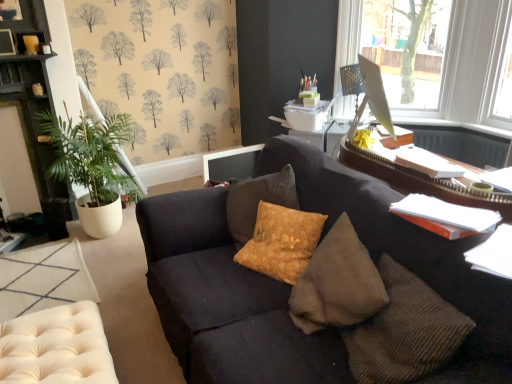
Question: Does transparent glass monitor at upper right turn towards dark wood cabinet at left?

Choices:
 (A) no
 (B) yes

Answer: (A)

Question: Considering the relative sizes of transparent glass monitor at upper right and dark wood cabinet at left in the image provided, is transparent glass monitor at upper right bigger than dark wood cabinet at left?

Choices:
 (A) no
 (B) yes

Answer: (B)

Question: From the image's perspective, would you say transparent glass monitor at upper right is positioned over dark wood cabinet at left?

Choices:
 (A) no
 (B) yes

Answer: (B)

Question: Can you confirm if transparent glass monitor at upper right is wider than dark wood cabinet at left?

Choices:
 (A) no
 (B) yes

Answer: (A)

Question: From the image's perspective, is transparent glass monitor at upper right located beneath dark wood cabinet at left?

Choices:
 (A) no
 (B) yes

Answer: (A)

Question: Is transparent glass monitor at upper right shorter than dark wood cabinet at left?

Choices:
 (A) yes
 (B) no

Answer: (A)

Question: Can you confirm if suede textured pillow at center is taller than metallic mesh table lamp at upper right?

Choices:
 (A) yes
 (B) no

Answer: (A)

Question: Can you confirm if suede textured pillow at center is thinner than metallic mesh table lamp at upper right?

Choices:
 (A) yes
 (B) no

Answer: (A)

Question: Is suede textured pillow at center positioned beyond the bounds of metallic mesh table lamp at upper right?

Choices:
 (A) no
 (B) yes

Answer: (B)

Question: Considering the relative sizes of suede textured pillow at center and metallic mesh table lamp at upper right in the image provided, is suede textured pillow at center smaller than metallic mesh table lamp at upper right?

Choices:
 (A) yes
 (B) no

Answer: (B)

Question: Does suede textured pillow at center have a greater width compared to metallic mesh table lamp at upper right?

Choices:
 (A) no
 (B) yes

Answer: (A)

Question: From the image's perspective, is suede textured pillow at center located above metallic mesh table lamp at upper right?

Choices:
 (A) yes
 (B) no

Answer: (B)

Question: From the image's perspective, would you say metallic mesh table lamp at upper right is shown under beige tufted ottoman at lower left?

Choices:
 (A) yes
 (B) no

Answer: (B)